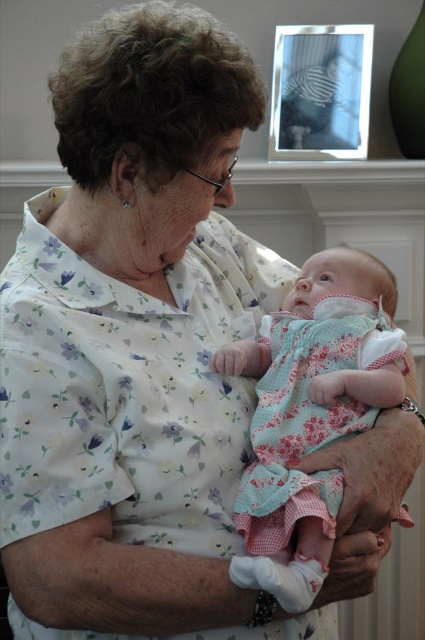
You are an interior designer planning to hang a new picture frame on the wall. You have a small decorative frame that is 10 cm wide. Considering the existing metallic silver picture frame at upper center and the floral fabric baby at center, which object would be more appropriate to place the new frame near? Explain your reasoning based on their sizes.

The metallic silver picture frame at upper center is smaller in size than the floral fabric baby at center. Since the new frame is 10 cm wide, it would be more appropriate to place it near the metallic silver picture frame at upper center to maintain visual balance and avoid overcrowding the space around the larger floral fabric baby at center.

You are an interior designer planning to hang a new picture frame on the wall. You notice the floral fabric baby at center and the metallic silver picture frame at upper center. Which object is taller?

The floral fabric baby at center is taller than the metallic silver picture frame at upper center.

You are an interior designer planning to place a new decorative item on the wall between the floral fabric baby at center and the metallic silver picture frame at upper center. Which object should you consider the size of when choosing the new item to ensure it fits appropriately?

Since the floral fabric baby at center is wider than the metallic silver picture frame at upper center, you should consider the size of the floral fabric baby at center to ensure the new decorative item fits appropriately between them.